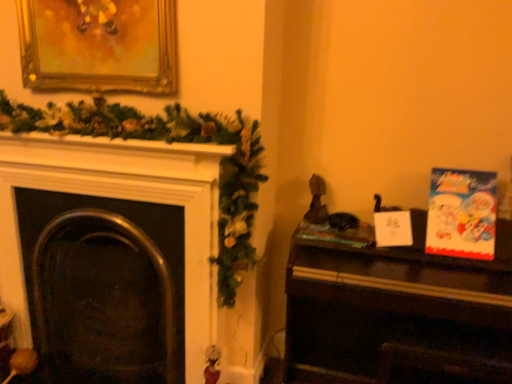
Question: Relative to metallic dark fireplace at left, is wooden piano at right in front or behind?

Choices:
 (A) behind
 (B) front

Answer: (B)

Question: Which is correct: wooden piano at right is inside metallic dark fireplace at left, or outside of it?

Choices:
 (A) inside
 (B) outside

Answer: (B)

Question: Which is nearer to the cartoon paper christmas card at right?

Choices:
 (A) hardcover book at center-right
 (B) metallic dark fireplace at left
 (C) wooden piano at right
 (D) gold ornate picture frame at upper left

Answer: (C)

Question: Considering the real-world distances, which object is closest to the gold ornate picture frame at upper left?

Choices:
 (A) cartoon paper christmas card at right
 (B) wooden piano at right
 (C) metallic dark fireplace at left
 (D) hardcover book at center-right

Answer: (C)